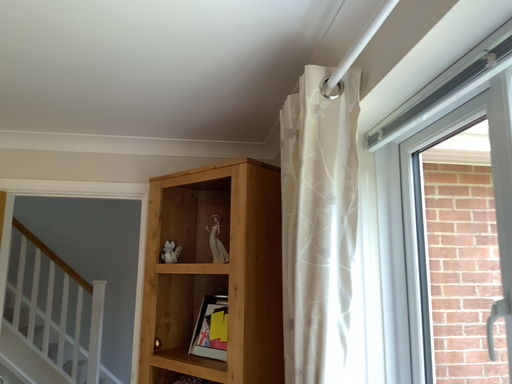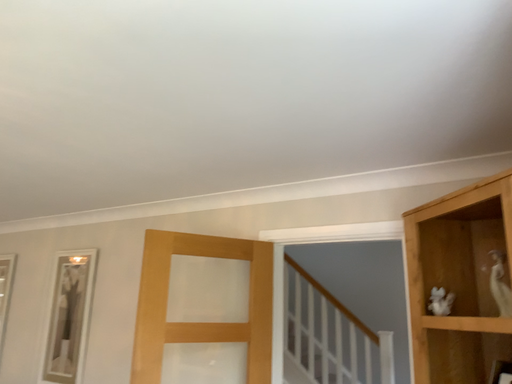
Question: How did the camera likely rotate when shooting the video?

Choices:
 (A) rotated left
 (B) rotated right

Answer: (A)